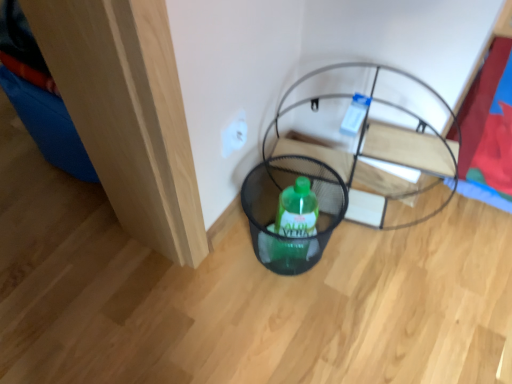
The width and height of the screenshot is (512, 384). Describe the element at coordinates (277, 209) in the screenshot. I see `black mesh basket at lower center` at that location.

Locate an element on the screen. This screenshot has height=384, width=512. black mesh basket at center is located at coordinates (376, 141).

From the image's perspective, which one is positioned higher, black mesh basket at lower center or black mesh basket at center?

black mesh basket at center, from the image's perspective.

Based on their sizes in the image, would you say black mesh basket at lower center is bigger or smaller than black mesh basket at center?

Clearly, black mesh basket at lower center is smaller in size than black mesh basket at center.

Would you say black mesh basket at lower center is a long distance from black mesh basket at center?

No, there isn't a large distance between black mesh basket at lower center and black mesh basket at center.

Considering the sizes of black mesh basket at lower center and black mesh basket at center in the image, is black mesh basket at lower center wider or thinner than black mesh basket at center?

Clearly, black mesh basket at lower center has less width compared to black mesh basket at center.

Measure the distance from black mesh basket at center to black mesh basket at lower center.

black mesh basket at center and black mesh basket at lower center are 6.09 inches apart.

The width and height of the screenshot is (512, 384). In order to click on furniture on the right of black mesh basket at lower center in this screenshot , I will do `click(376, 141)`.

Considering the sizes of objects black mesh basket at center and black mesh basket at lower center in the image provided, who is taller, black mesh basket at center or black mesh basket at lower center?

Standing taller between the two is black mesh basket at center.

In the scene shown: Is black mesh basket at center surrounding black mesh basket at lower center?

That's incorrect, black mesh basket at lower center is not inside black mesh basket at center.

Identify the location of basket on the right of white plastic electric outlet at center. This screenshot has height=384, width=512. (277, 209).

Based on their positions, is black mesh basket at lower center located to the left or right of white plastic electric outlet at center?

black mesh basket at lower center is to the right of white plastic electric outlet at center.

In the scene shown: Can you confirm if black mesh basket at lower center is wider than white plastic electric outlet at center?

Yes.

In the scene shown: From the image's perspective, is black mesh basket at center beneath white plastic electric outlet at center?

Yes, from the image's perspective, black mesh basket at center is below white plastic electric outlet at center.

Is black mesh basket at center wider or thinner than white plastic electric outlet at center?

In the image, black mesh basket at center appears to be wider than white plastic electric outlet at center.

In terms of size, does black mesh basket at center appear bigger or smaller than white plastic electric outlet at center?

In the image, black mesh basket at center appears to be larger than white plastic electric outlet at center.

From a real-world perspective, which object rests below the other?

black mesh basket at center is physically lower.

How much distance is there between white plastic electric outlet at center and black mesh basket at center?

white plastic electric outlet at center is 12.73 inches from black mesh basket at center.

Does white plastic electric outlet at center appear on the right side of black mesh basket at center?

In fact, white plastic electric outlet at center is to the left of black mesh basket at center.

From the picture: Is white plastic electric outlet at center not within black mesh basket at center?

That's correct, white plastic electric outlet at center is outside of black mesh basket at center.

What's the angular difference between white plastic electric outlet at center and black mesh basket at center's facing directions?

The angle between the facing direction of white plastic electric outlet at center and the facing direction of black mesh basket at center is 77.1 degrees.

Does white plastic electric outlet at center come in front of black mesh basket at lower center?

No, white plastic electric outlet at center is behind black mesh basket at lower center.

Is white plastic electric outlet at center oriented towards black mesh basket at lower center?

Yes.

From a real-world perspective, is white plastic electric outlet at center over black mesh basket at lower center?

Yes, from a real-world perspective, white plastic electric outlet at center is above black mesh basket at lower center.

Where is `furniture located in front of the black mesh basket at lower center`? The width and height of the screenshot is (512, 384). furniture located in front of the black mesh basket at lower center is located at coordinates (376, 141).

I want to click on furniture located above the black mesh basket at lower center (from a real-world perspective), so click(376, 141).

From the image, which object appears to be nearer to black mesh basket at center, white plastic electric outlet at center or black mesh basket at lower center?

black mesh basket at lower center lies closer to black mesh basket at center than the other object.

Looking at the image, which one is located further to black mesh basket at center, black mesh basket at lower center or white plastic electric outlet at center?

white plastic electric outlet at center is further to black mesh basket at center.

Considering their positions, is black mesh basket at center positioned closer to white plastic electric outlet at center than black mesh basket at lower center?

Among the two, black mesh basket at lower center is located nearer to white plastic electric outlet at center.

Considering their positions, is black mesh basket at center positioned further to black mesh basket at lower center than white plastic electric outlet at center?

The object further to black mesh basket at lower center is white plastic electric outlet at center.

Estimate the real-world distances between objects in this image. Which object is closer to white plastic electric outlet at center, black mesh basket at lower center or black mesh basket at center?

The object closer to white plastic electric outlet at center is black mesh basket at lower center.

Considering their positions, is white plastic electric outlet at center positioned further to black mesh basket at lower center than black mesh basket at center?

white plastic electric outlet at center lies further to black mesh basket at lower center than the other object.

Where is `basket between white plastic electric outlet at center and black mesh basket at center in the horizontal direction`? This screenshot has width=512, height=384. basket between white plastic electric outlet at center and black mesh basket at center in the horizontal direction is located at coordinates (277, 209).